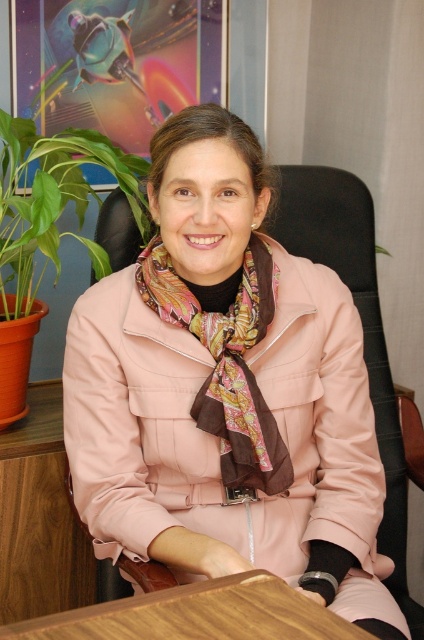
You are standing in an office and want to reach a specific point marked as point (x=72, y=474). Can you estimate how far you need to walk to reach that point?

The distance between point (x=72, y=474) and the viewer is 1.18 meters, so you need to walk approximately 1.18 meters to reach that point.

Where is the pink fabric coat at center located in the image?

The pink fabric coat at center is located at point (x=226, y=392).

You are an interior designer planning to place a new chair in this office. The chair you have chosen is the same size as the green leafy plant at left. Will the pink fabric coat at center fit comfortably on the chair without looking too cramped?

The pink fabric coat at center has a larger size compared to the green leafy plant at left. Since the chair is the same size as the plant, the coat may not fit comfortably on the chair as it is larger and could appear cramped.